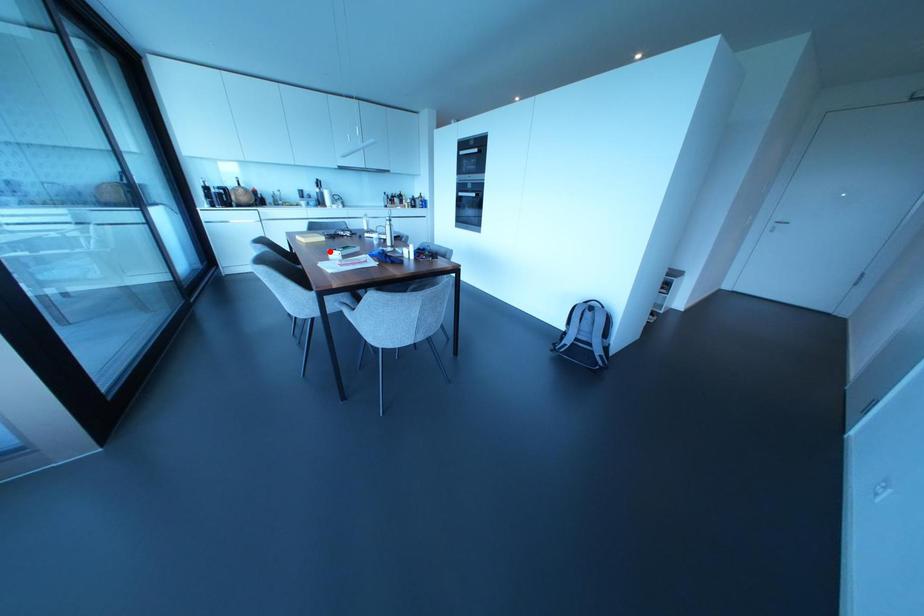
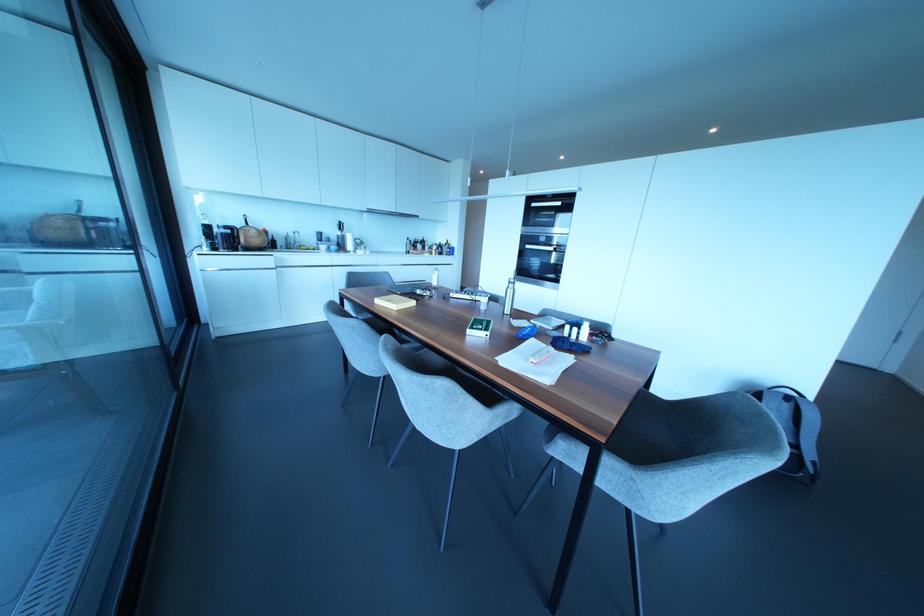
The point at the highlighted location is marked in the first image. Where is the corresponding point in the second image?

(468, 331)